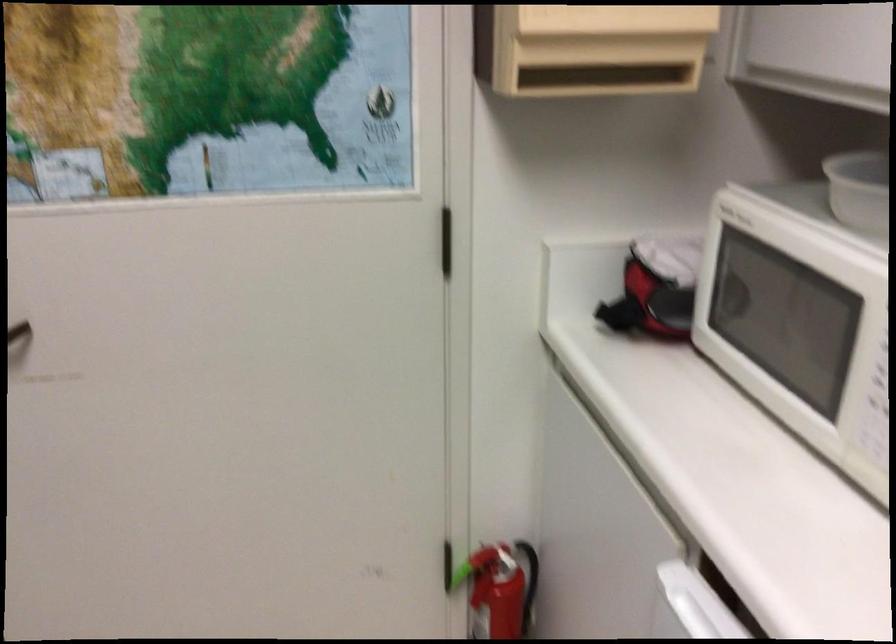
Question: The camera is either moving clockwise (left) or counter-clockwise (right) around the object. The first image is from the beginning of the video and the second image is from the end. Is the camera moving left or right when shooting the video?

Choices:
 (A) Left
 (B) Right

Answer: (B)